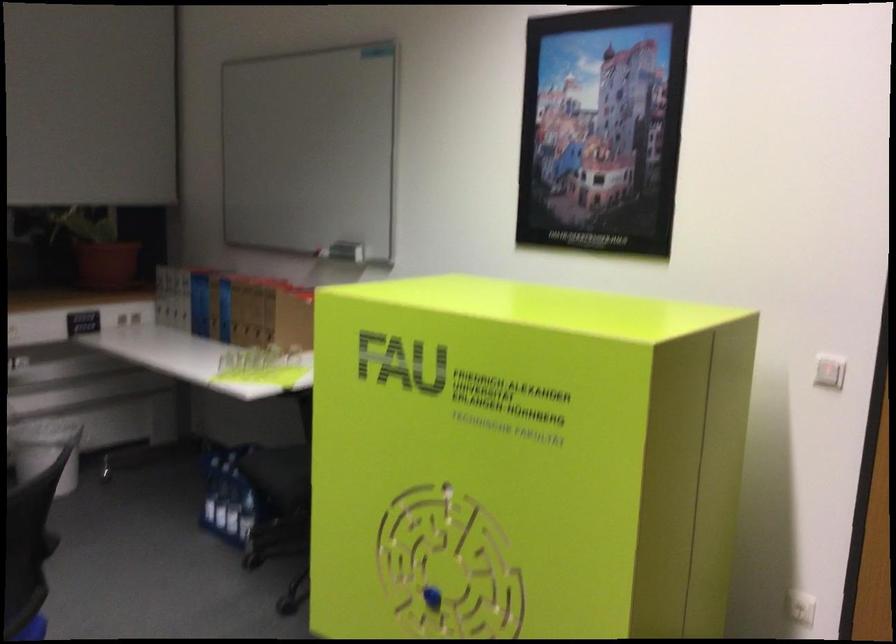
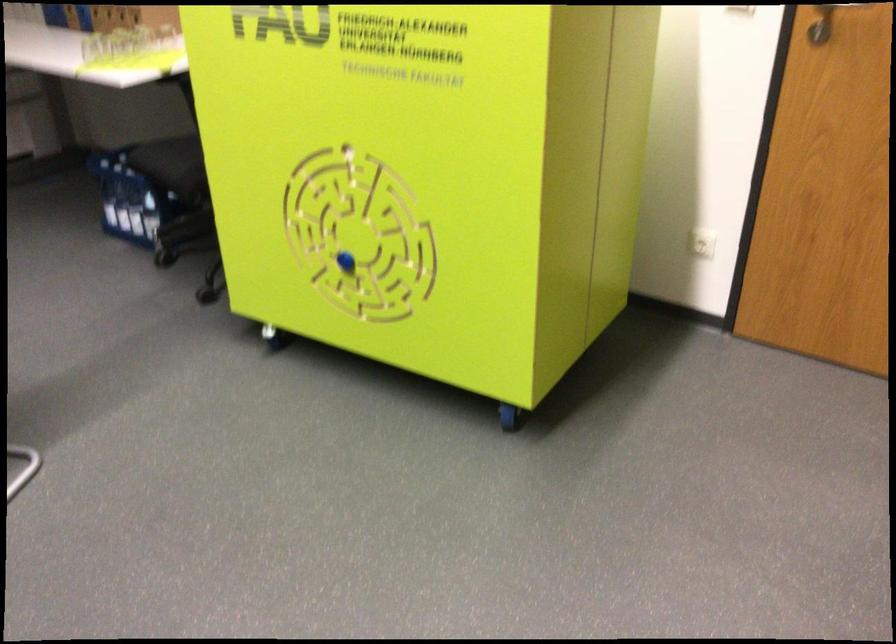
Find the pixel in the second image that matches (248,486) in the first image.

(149, 185)